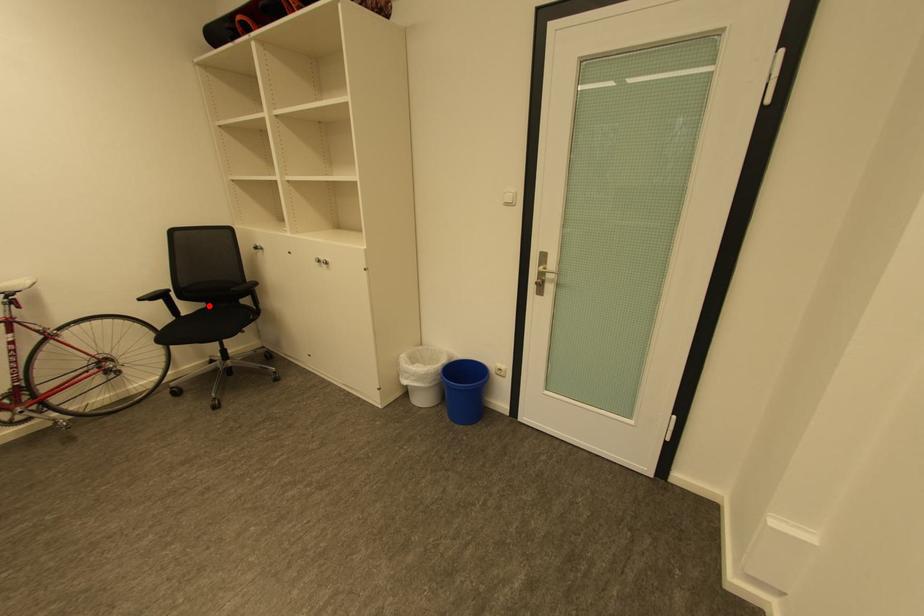
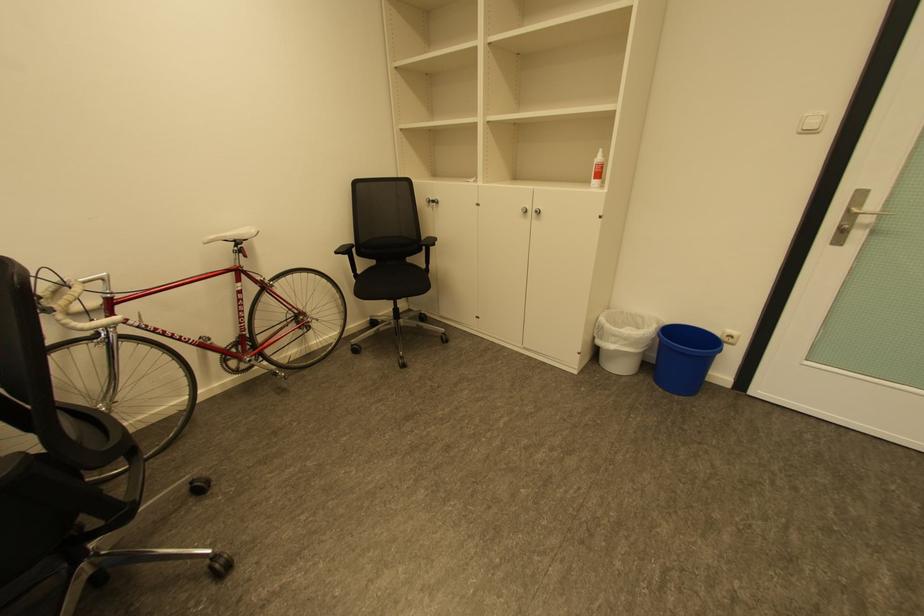
Find the pixel in the second image that matches the highlighted location in the first image.

(380, 262)